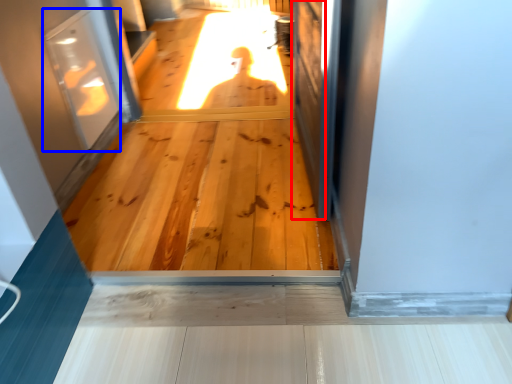
Question: Which of the following is the closest to the observer, screen door (highlighted by a red box) or screen door (highlighted by a blue box)?

Choices:
 (A) screen door
 (B) screen door

Answer: (A)